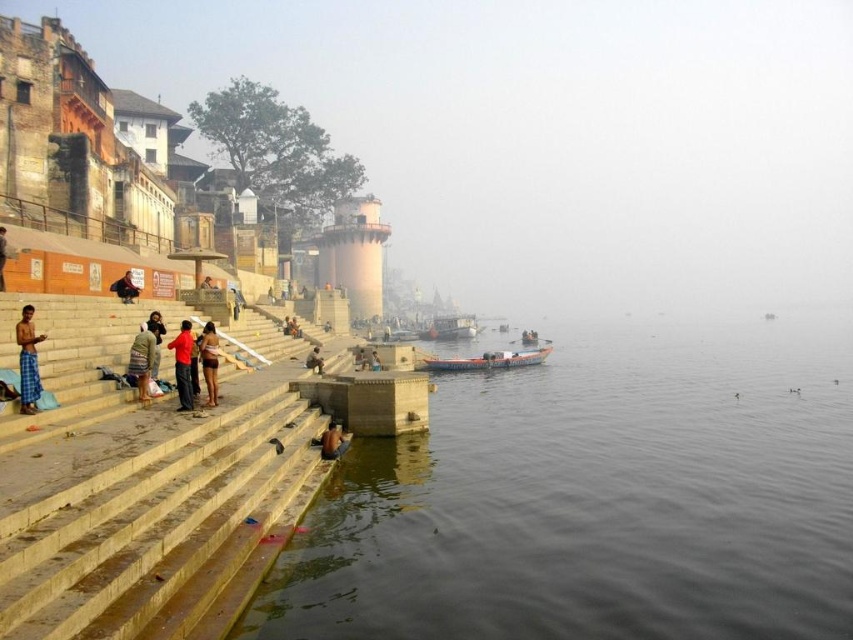
You are standing at the riverside and want to determine which of the two points, point (149, 317) or point (310, 365), is closer to you. Based on the scene description, which point is nearer?

Point (149, 317) is closer to the viewer than point (310, 365).

You are standing on the stone steps leading down to the water and want to place a small item on the nearest dark blue fabric. Which dark blue fabric should you choose between the dark blue fabric at lower left and the dark blue fabric at lower center?

The dark blue fabric at lower left is to the left of dark blue fabric at lower center. Since you are on the stone steps, the nearest dark blue fabric would depend on your exact position. However, if you are at the lower part of the steps, the dark blue fabric at lower left is closer to you, so you should choose that one.

You are a photographer trying to capture both the dark blue fabric at center and the dark blue fabric at lower center in a single frame. Since you want to highlight the larger one, which fabric should you focus on and why?

The dark blue fabric at center is bigger than the dark blue fabric at lower center, so you should focus on the dark blue fabric at center to highlight the larger one.